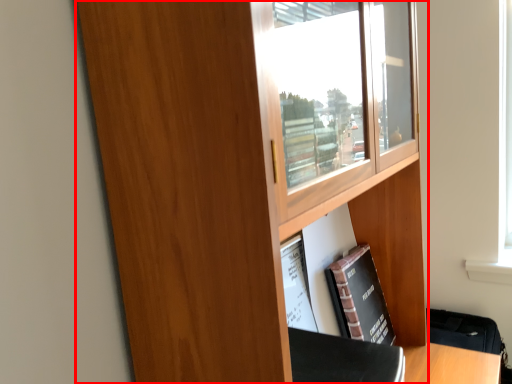
Question: From the image's perspective, what is the correct spatial relationship of cupboard (annotated by the red box) in relation to book?

Choices:
 (A) above
 (B) below

Answer: (A)